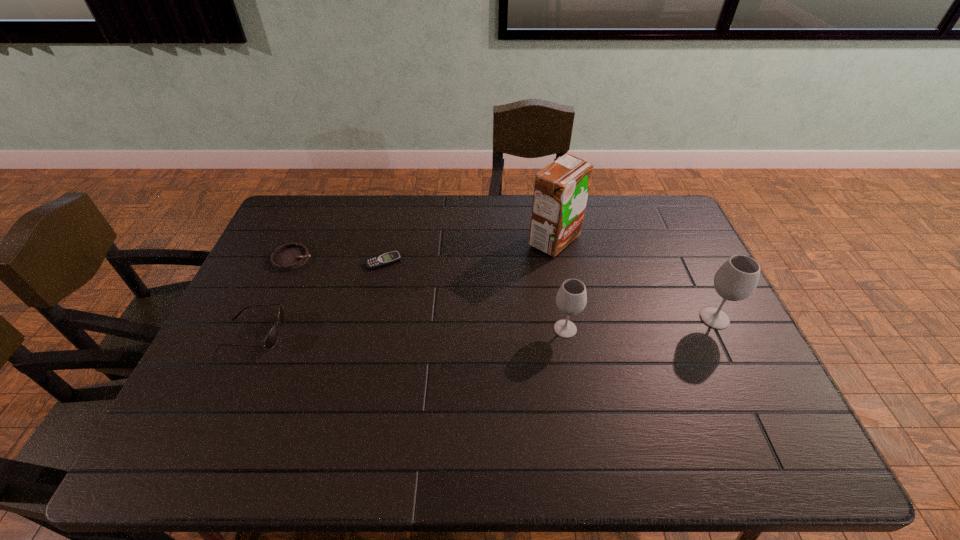
Image resolution: width=960 pixels, height=540 pixels. In order to click on free spot between the third object from left to right and the shorter wineglass in this screenshot , I will do `click(474, 295)`.

The image size is (960, 540). I want to click on free space between the ashtray and the fourth object from right to left, so click(x=339, y=260).

You are a GUI agent. You are given a task and a screenshot of the screen. Output one action in this format:
    pyautogui.click(x=<x>, y=<y>)
    Task: Click on the free point between the fifth shortest object and the carton
    The image size is (960, 540).
    Given the screenshot: What is the action you would take?
    pyautogui.click(x=635, y=279)

Locate an element on the screen. free space between the shortest object and the second shortest object is located at coordinates (339, 260).

I want to click on free space between the sunglasses and the third tallest object, so click(x=410, y=331).

Locate an element on the screen. Image resolution: width=960 pixels, height=540 pixels. free space between the second shortest object and the left wineglass is located at coordinates (429, 294).

Find the location of a particular element. the fifth closest object to the fourth tallest object is located at coordinates (737, 279).

Identify which object is the closest to the shorter wineglass. Please provide its 2D coordinates. Your answer should be formatted as a tuple, i.e. [(x, y)], where the tuple contains the x and y coordinates of a point satisfying the conditions above.

[(561, 189)]

I want to click on free location that satisfies the following two spatial constraints: 1. on the straw side of the carton; 2. on the left side of the right wineglass, so click(x=568, y=319).

The width and height of the screenshot is (960, 540). I want to click on free location that satisfies the following two spatial constraints: 1. on the back side of the shorter wineglass; 2. on the right side of the taller wineglass, so click(564, 319).